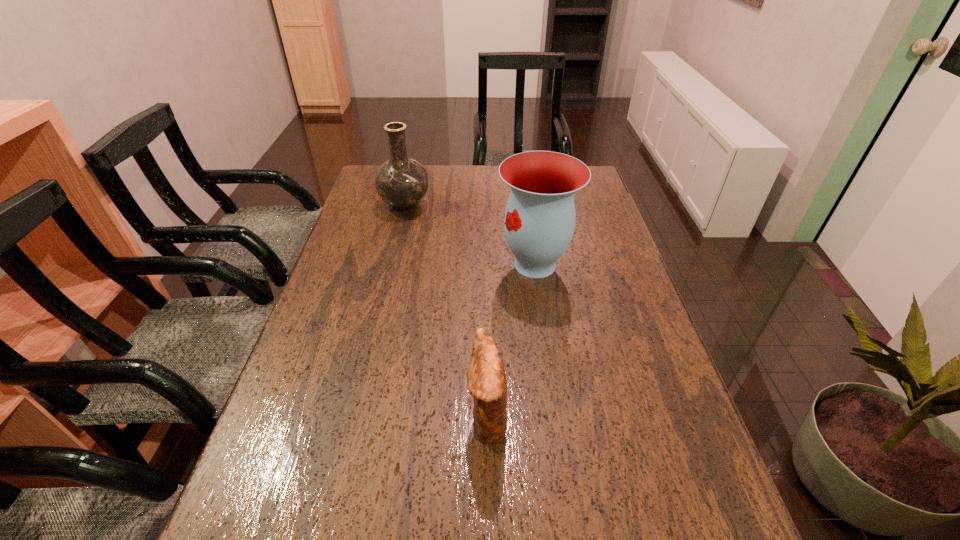
You are a GUI agent. You are given a task and a screenshot of the screen. Output one action in this format:
    pyautogui.click(x=<x>, y=<y>)
    Task: Click on the free space located 0.290m on the open side of the nearest object
    The width and height of the screenshot is (960, 540).
    Given the screenshot: What is the action you would take?
    pyautogui.click(x=326, y=417)

This screenshot has height=540, width=960. Identify the location of object present at the far edge. (402, 182).

This screenshot has width=960, height=540. In order to click on object at the left edge in this screenshot , I will do `click(402, 182)`.

Identify the location of object at the right edge. (539, 222).

At what (x,y) coordinates should I click in order to perform the action: click on object situated at the far left corner. Please return your answer as a coordinate pair (x, y). Looking at the image, I should click on (402, 182).

At what (x,y) coordinates should I click in order to perform the action: click on free space at the far edge. Please return your answer as a coordinate pair (x, y). Looking at the image, I should click on [x=469, y=172].

This screenshot has height=540, width=960. What are the coordinates of `vacant space at the left edge of the desktop` in the screenshot? It's located at (324, 352).

Where is `vacant space at the right edge`? The width and height of the screenshot is (960, 540). vacant space at the right edge is located at coordinates (587, 203).

Locate an element on the screen. The image size is (960, 540). vacant space at the far left corner of the desktop is located at coordinates (373, 165).

Identify the location of empty location between the clutch bag and the left vase. (445, 311).